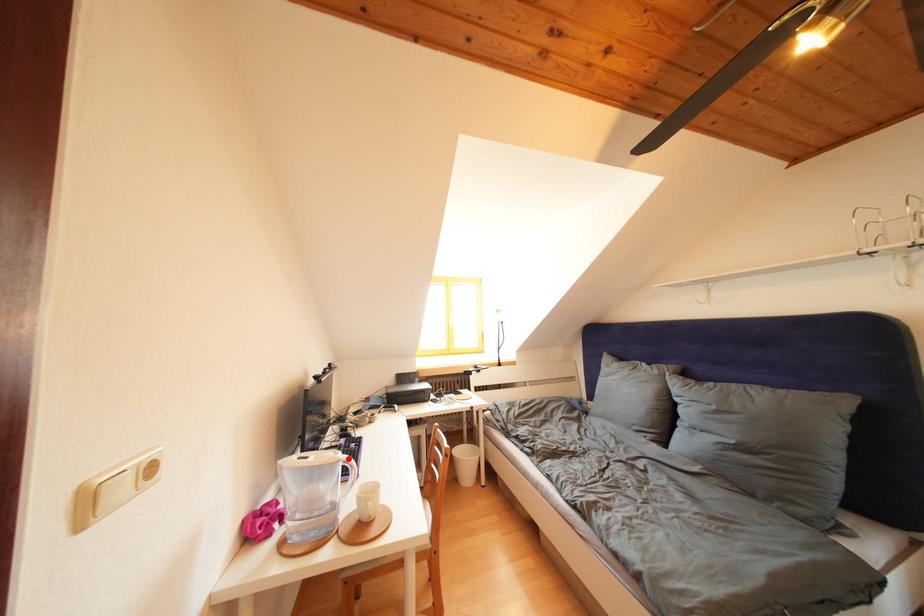
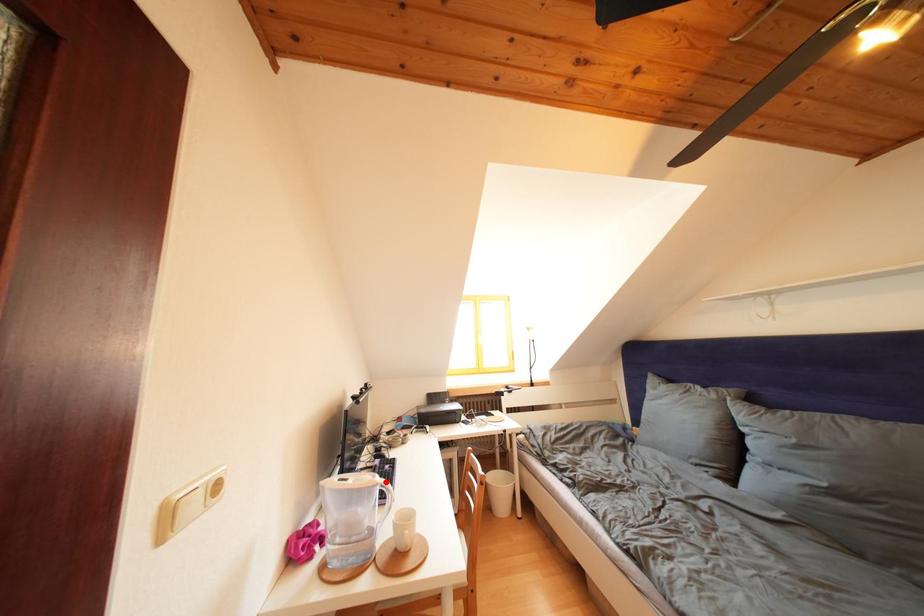
I am providing you with two images of the same scene from different viewpoints. A red point is marked on the first image and another point is marked on the second image. Does the point marked in image1 correspond to the same location as the one in image2?

Yes